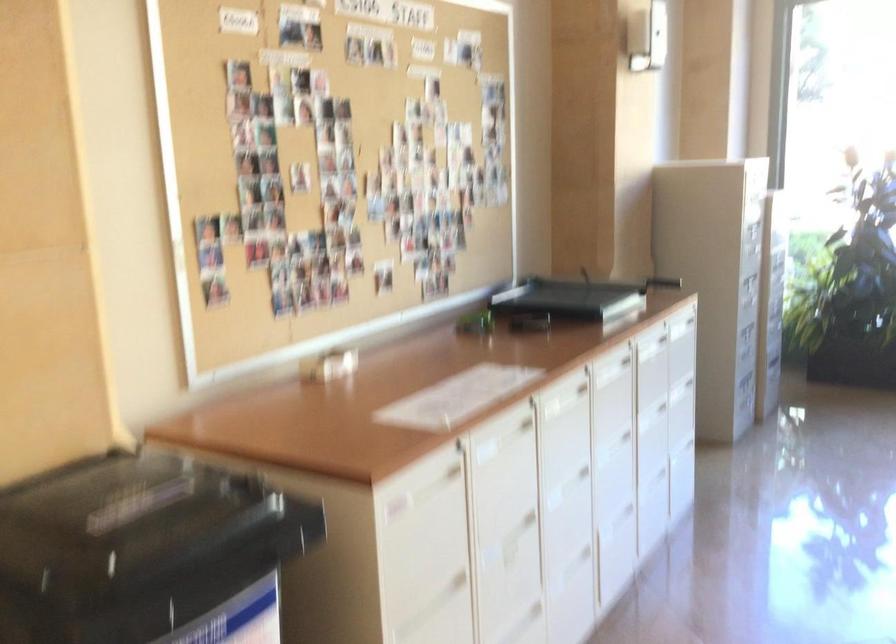
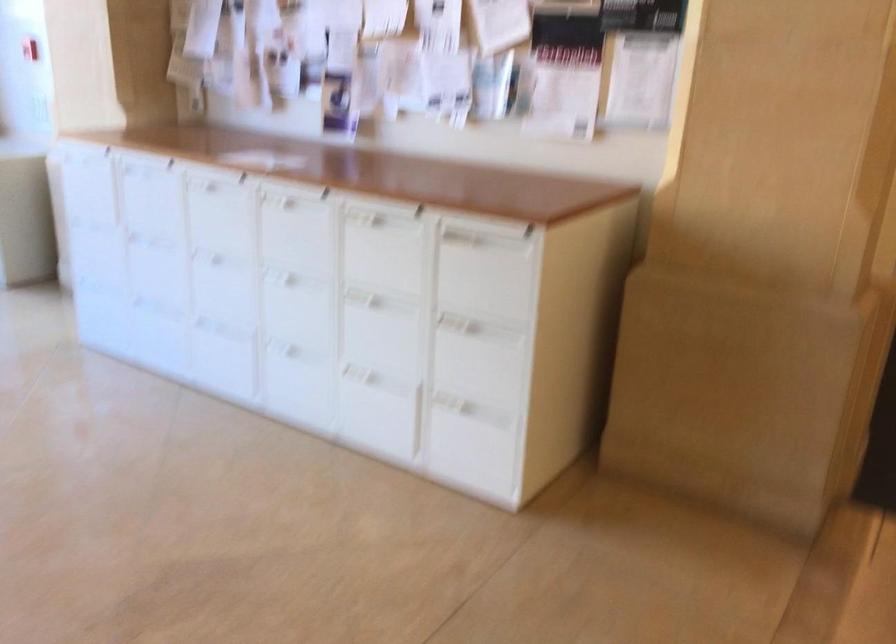
Question: The first image is from the beginning of the video and the second image is from the end. How did the camera likely rotate when shooting the video?

Choices:
 (A) Left
 (B) Right
 (C) Up
 (D) Down

Answer: (B)